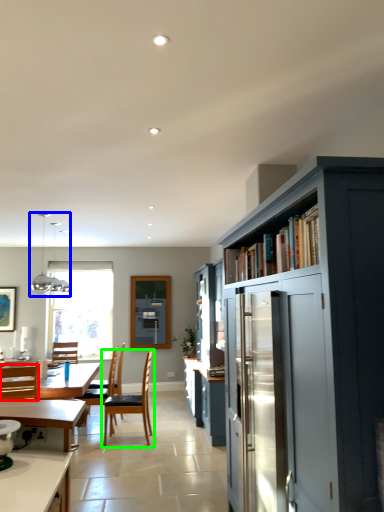
Question: Which is farther away from chair (highlighted by a red box)? light fixture (highlighted by a blue box) or chair (highlighted by a green box)?

Choices:
 (A) light fixture
 (B) chair

Answer: (A)